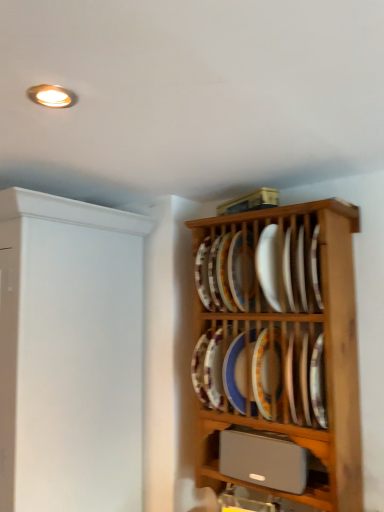
Question: Is white glossy plate at center, placed as the 1th platter when sorted from top to bottom, to the left of porcelain plate at center, acting as the third platter starting from the bottom, from the viewer's perspective?

Choices:
 (A) yes
 (B) no

Answer: (A)

Question: Is white glossy plate at center, placed as the 1th platter when sorted from top to bottom, facing towards porcelain plate at center, the 3th platter viewed from the top?

Choices:
 (A) yes
 (B) no

Answer: (B)

Question: Is white glossy plate at center, which ranks as the fifth platter in bottom-to-top order, at the right side of porcelain plate at center, the 3th platter viewed from the top?

Choices:
 (A) yes
 (B) no

Answer: (B)

Question: From the image's perspective, is white glossy plate at center, placed as the 1th platter when sorted from top to bottom, located beneath porcelain plate at center, acting as the third platter starting from the bottom?

Choices:
 (A) yes
 (B) no

Answer: (B)

Question: Is white glossy plate at center, which ranks as the fifth platter in bottom-to-top order, outside of porcelain plate at center, acting as the third platter starting from the bottom?

Choices:
 (A) no
 (B) yes

Answer: (B)

Question: Is white glossy plate at center, placed as the 1th platter when sorted from top to bottom, bigger or smaller than silver metallic speaker at lower center?

Choices:
 (A) small
 (B) big

Answer: (A)

Question: From a real-world perspective, is white glossy plate at center, which ranks as the fifth platter in bottom-to-top order, above or below silver metallic speaker at lower center?

Choices:
 (A) below
 (B) above

Answer: (B)

Question: Relative to silver metallic speaker at lower center, is white glossy plate at center, placed as the 1th platter when sorted from top to bottom, in front or behind?

Choices:
 (A) behind
 (B) front

Answer: (A)

Question: In terms of width, does white glossy plate at center, placed as the 1th platter when sorted from top to bottom, look wider or thinner when compared to silver metallic speaker at lower center?

Choices:
 (A) wide
 (B) thin

Answer: (A)

Question: Based on their sizes in the image, would you say silver metallic speaker at lower center is bigger or smaller than porcelain plate at center, positioned as the fourth platter in bottom-to-top order?

Choices:
 (A) big
 (B) small

Answer: (A)

Question: Is silver metallic speaker at lower center in front of or behind porcelain plate at center, positioned as the fourth platter in bottom-to-top order, in the image?

Choices:
 (A) behind
 (B) front

Answer: (B)

Question: From a real-world perspective, is silver metallic speaker at lower center above or below porcelain plate at center, positioned as the fourth platter in bottom-to-top order?

Choices:
 (A) above
 (B) below

Answer: (B)

Question: Is point (321, 457) closer or farther from the camera than point (235, 251)?

Choices:
 (A) closer
 (B) farther

Answer: (A)

Question: Considering the positions of porcelain plate at center, which ranks as the 2th platter in top-to-bottom order, and blue glossy platter at center, the first platter in the bottom-to-top sequence, in the image, is porcelain plate at center, which ranks as the 2th platter in top-to-bottom order, wider or thinner than blue glossy platter at center, the first platter in the bottom-to-top sequence,?

Choices:
 (A) thin
 (B) wide

Answer: (A)

Question: Would you say porcelain plate at center, which ranks as the 2th platter in top-to-bottom order, is inside or outside blue glossy platter at center, the first platter in the bottom-to-top sequence?

Choices:
 (A) outside
 (B) inside

Answer: (A)